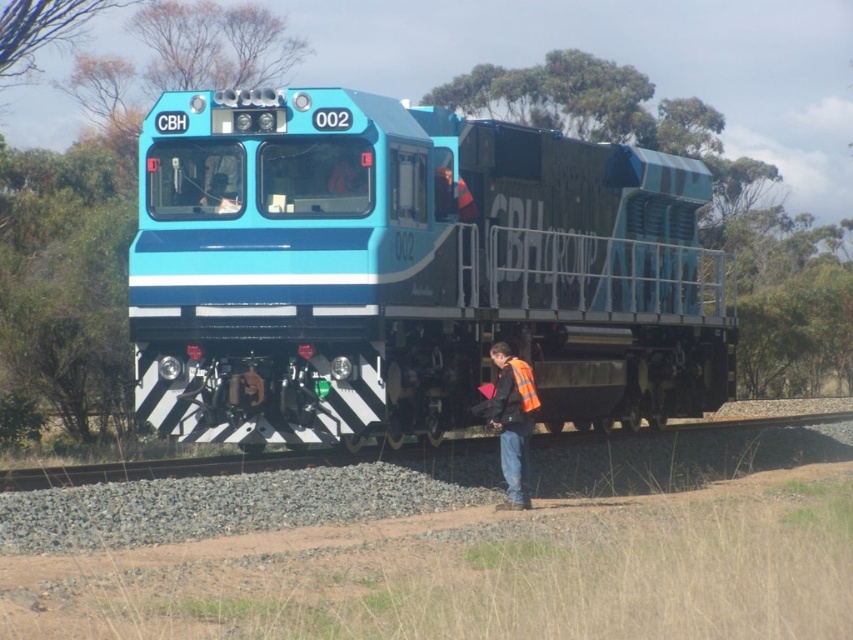
Question: Does black asphalt train track at lower center appear on the left side of orange reflective vest at lower center?

Choices:
 (A) no
 (B) yes

Answer: (A)

Question: Estimate the real-world distances between objects in this image. Which object is farther from the orange reflective vest at lower center?

Choices:
 (A) black asphalt train track at lower center
 (B) blue glossy locomotive at center

Answer: (A)

Question: Which object is the closest to the black asphalt train track at lower center?

Choices:
 (A) blue glossy locomotive at center
 (B) orange reflective vest at lower center

Answer: (A)

Question: From the image, what is the correct spatial relationship of blue glossy locomotive at center in relation to orange reflective vest at lower center?

Choices:
 (A) above
 (B) below

Answer: (A)

Question: Which point is closer to the camera taking this photo?

Choices:
 (A) (500, 384)
 (B) (134, 252)
 (C) (720, 428)

Answer: (A)

Question: Does black asphalt train track at lower center have a larger size compared to orange reflective vest at lower center?

Choices:
 (A) no
 (B) yes

Answer: (B)